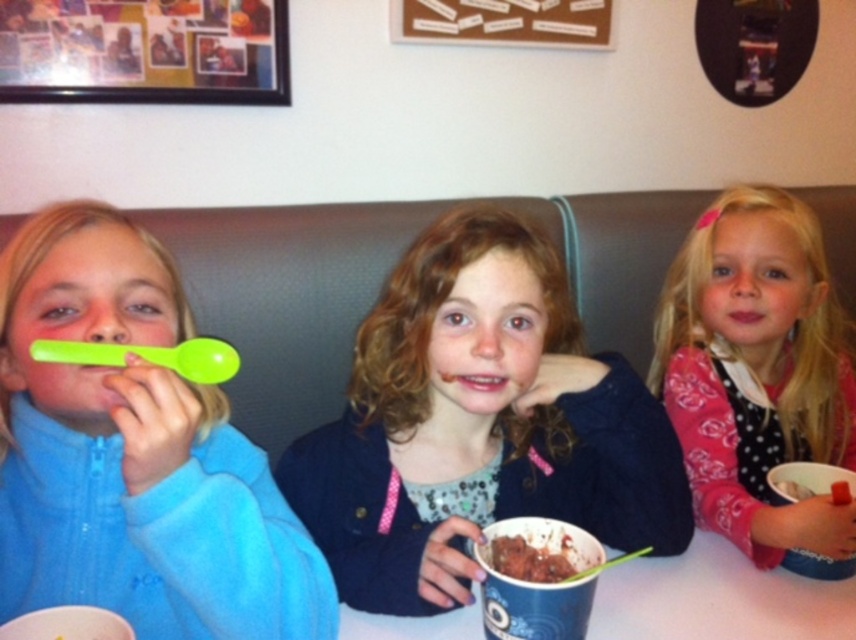
Question: Can you confirm if matte green spoon at left is positioned above pink glossy lips at center?

Choices:
 (A) yes
 (B) no

Answer: (B)

Question: In this image, where is matte blue sweater at center located relative to matte pink lips at center?

Choices:
 (A) above
 (B) below

Answer: (B)

Question: Which of the following is the farthest from the observer?

Choices:
 (A) pink glossy lips at center
 (B) chocolate ice cream at lower center
 (C) white matte table at center
 (D) chocolate cake at center

Answer: (B)

Question: Is matte green spoon at left to the left of matte pink lips at center from the viewer's perspective?

Choices:
 (A) no
 (B) yes

Answer: (B)

Question: Which point is closer to the camera?

Choices:
 (A) (185, 561)
 (B) (738, 308)
 (C) (501, 556)

Answer: (A)

Question: Considering the real-world distances, which object is farthest from the chocolate cake at center?

Choices:
 (A) matte pink lips at center
 (B) white matte table at center

Answer: (A)